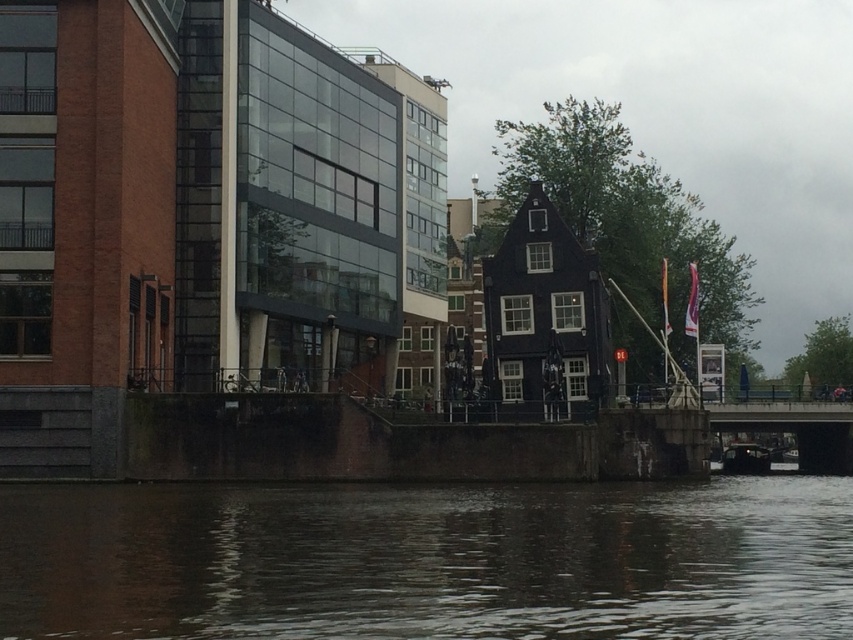
Question: Is brown water at lower center above dark brown wooden boat at lower right?

Choices:
 (A) yes
 (B) no

Answer: (A)

Question: Does brown water at lower center have a larger size compared to dark brown wooden boat at lower right?

Choices:
 (A) yes
 (B) no

Answer: (A)

Question: Which of the following is the farthest from the observer?

Choices:
 (A) dark brown wooden boat at lower right
 (B) brown water at lower center

Answer: (A)

Question: Does brown water at lower center have a greater width compared to dark brown wooden boat at lower right?

Choices:
 (A) yes
 (B) no

Answer: (A)